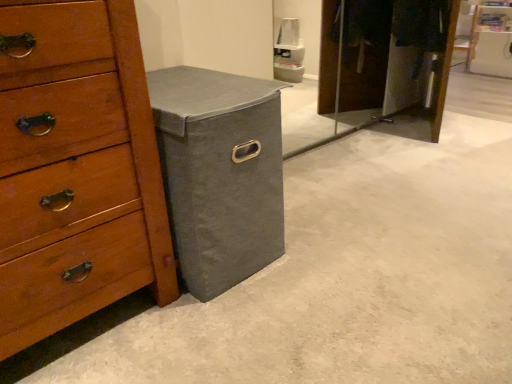
The width and height of the screenshot is (512, 384). Find the location of `vacant area in front of gray fabric storage bin at lower left`. vacant area in front of gray fabric storage bin at lower left is located at coordinates (236, 332).